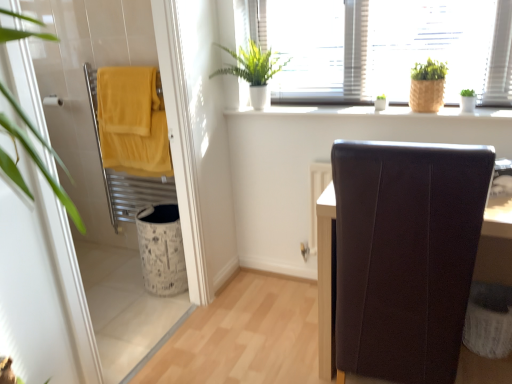
Identify the location of vacant space positioned to the left of brown leather chair at right. (258, 337).